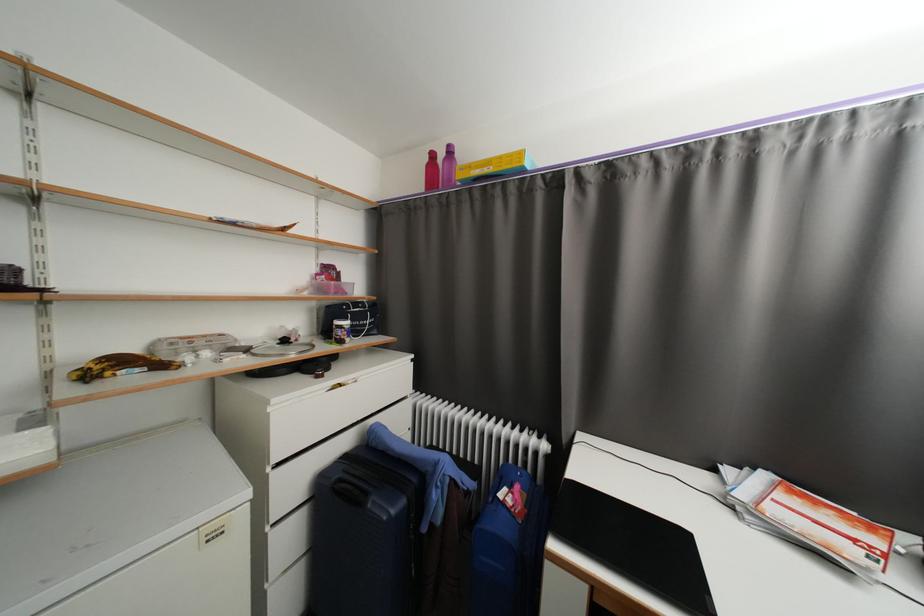
Identify the location of yellow cardboard box. (493, 166).